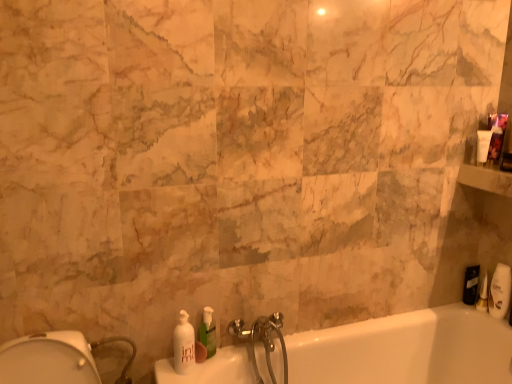
What is the approximate height of silver metallic faucet at lower center?

14.55 inches.

This screenshot has width=512, height=384. Identify the location of black matte toiletry at right, which appears as the 2th toiletry when viewed from the front. (471, 285).

Is white glossy bathtub at lower right situated inside silver metallic faucet at lower center or outside?

white glossy bathtub at lower right lies outside silver metallic faucet at lower center.

Can you confirm if white glossy bathtub at lower right is thinner than silver metallic faucet at lower center?

No, white glossy bathtub at lower right is not thinner than silver metallic faucet at lower center.

Is white glossy bathtub at lower right aimed at silver metallic faucet at lower center?

No, white glossy bathtub at lower right is not aimed at silver metallic faucet at lower center.

From their relative heights in the image, would you say white plastic soap dispenser at right, the 1th toiletry positioned from the front, is taller or shorter than black matte toiletry at right, which appears as the 2th toiletry when viewed from the front?

Clearly, white plastic soap dispenser at right, the 1th toiletry positioned from the front, is shorter compared to black matte toiletry at right, which appears as the 2th toiletry when viewed from the front.

The image size is (512, 384). I want to click on toiletry above the white plastic soap dispenser at right, the 1th toiletry positioned from the front (from the image's perspective), so click(x=471, y=285).

From a real-world perspective, who is located higher, white plastic soap dispenser at right, the 1th toiletry positioned from the front, or black matte toiletry at right, which is counted as the 1th toiletry, starting from the back?

From a 3D spatial view, black matte toiletry at right, which is counted as the 1th toiletry, starting from the back, is above.

Can black matte toiletry at right, which appears as the 2th toiletry when viewed from the front, be found inside white plastic soap dispenser at right, the 1th toiletry positioned from the front?

No, black matte toiletry at right, which appears as the 2th toiletry when viewed from the front, is located outside of white plastic soap dispenser at right, the 1th toiletry positioned from the front.

Is point (212, 317) positioned behind point (252, 325)?

No, it is in front of (252, 325).

Between green translucent soap dispenser at lower center, which ranks as the first soap dispenser in right-to-left order, and silver metallic faucet at lower center, which one has larger size?

silver metallic faucet at lower center.

From the picture: From a real-world perspective, is green translucent soap dispenser at lower center, which ranks as the first soap dispenser in right-to-left order, positioned above or below silver metallic faucet at lower center?

green translucent soap dispenser at lower center, which ranks as the first soap dispenser in right-to-left order, is above silver metallic faucet at lower center.

Does green translucent soap dispenser at lower center, the 2th soap dispenser when ordered from left to right, have a greater height compared to silver metallic faucet at lower center?

In fact, green translucent soap dispenser at lower center, the 2th soap dispenser when ordered from left to right, may be shorter than silver metallic faucet at lower center.

Is black matte toiletry at right, which is counted as the 1th toiletry, starting from the back, turned away from silver metallic faucet at lower center?

No.

Based on the photo, between black matte toiletry at right, which is counted as the 1th toiletry, starting from the back, and silver metallic faucet at lower center, which one has larger size?

With larger size is silver metallic faucet at lower center.

Is black matte toiletry at right, which appears as the 2th toiletry when viewed from the front, not near silver metallic faucet at lower center?

No, there isn't a large distance between black matte toiletry at right, which appears as the 2th toiletry when viewed from the front, and silver metallic faucet at lower center.

Is black matte toiletry at right, which appears as the 2th toiletry when viewed from the front, positioned beyond the bounds of silver metallic faucet at lower center?

Indeed, black matte toiletry at right, which appears as the 2th toiletry when viewed from the front, is completely outside silver metallic faucet at lower center.

Locate an element on the screen. tap that appears below the white plastic soap dispenser at right, which is the second toiletry in back-to-front order (from the image's perspective) is located at coordinates (264, 348).

From a real-world perspective, relative to silver metallic faucet at lower center, is white plastic soap dispenser at right, the 1th toiletry positioned from the front, vertically above or below?

In terms of real-world spatial position, white plastic soap dispenser at right, the 1th toiletry positioned from the front, is above silver metallic faucet at lower center.

Does point (487, 283) lie in front of point (280, 349)?

No, (487, 283) is further to viewer.

Considering the sizes of objects white plastic soap dispenser at right, the 1th toiletry positioned from the front, and silver metallic faucet at lower center in the image provided, who is bigger, white plastic soap dispenser at right, the 1th toiletry positioned from the front, or silver metallic faucet at lower center?

With larger size is silver metallic faucet at lower center.

Looking at this image, who is shorter, white glossy soap dispenser at lower left, the second soap dispenser positioned from the right, or silver metallic faucet at lower center?

white glossy soap dispenser at lower left, the second soap dispenser positioned from the right, is shorter.

Based on their positions, is white glossy soap dispenser at lower left, the second soap dispenser positioned from the right, located to the left or right of silver metallic faucet at lower center?

Clearly, white glossy soap dispenser at lower left, the second soap dispenser positioned from the right, is on the left of silver metallic faucet at lower center in the image.

Can you confirm if white glossy soap dispenser at lower left, the second soap dispenser positioned from the right, is smaller than silver metallic faucet at lower center?

Yes, white glossy soap dispenser at lower left, the second soap dispenser positioned from the right, is smaller than silver metallic faucet at lower center.

Is white glossy soap dispenser at lower left, positioned as the 1th soap dispenser in left-to-right order, positioned with its back to silver metallic faucet at lower center?

No, white glossy soap dispenser at lower left, positioned as the 1th soap dispenser in left-to-right order,'s orientation is not away from silver metallic faucet at lower center.

Between silver metallic faucet at lower center and white glossy bathtub at lower right, which one appears on the right side from the viewer's perspective?

white glossy bathtub at lower right.

Identify the location of tap on the left side of white glossy bathtub at lower right. The height and width of the screenshot is (384, 512). (264, 348).

Considering the points (263, 330) and (162, 374), which point is in front, point (263, 330) or point (162, 374)?

The point (162, 374) is closer to the camera.

Locate an element on the screen. bathtub on the right side of silver metallic faucet at lower center is located at coordinates (406, 349).

Image resolution: width=512 pixels, height=384 pixels. Find the location of `toiletry behind the white plastic soap dispenser at right, which is the second toiletry in back-to-front order`. toiletry behind the white plastic soap dispenser at right, which is the second toiletry in back-to-front order is located at coordinates coord(471,285).

Which object lies further to the anchor point white glossy bathtub at lower right, white glossy soap dispenser at lower left, the second soap dispenser positioned from the right, or green translucent soap dispenser at lower center, the 2th soap dispenser when ordered from left to right?

Among the two, green translucent soap dispenser at lower center, the 2th soap dispenser when ordered from left to right, is located further to white glossy bathtub at lower right.

When comparing their distances from white glossy soap dispenser at lower left, positioned as the 1th soap dispenser in left-to-right order, does black matte toiletry at right, which is counted as the 1th toiletry, starting from the back, or silver metallic faucet at lower center seem closer?

Based on the image, silver metallic faucet at lower center appears to be nearer to white glossy soap dispenser at lower left, positioned as the 1th soap dispenser in left-to-right order.

Estimate the real-world distances between objects in this image. Which object is further from white plastic soap dispenser at right, which is the second toiletry in back-to-front order, white glossy bathtub at lower right or black matte toiletry at right, which appears as the 2th toiletry when viewed from the front?

The object further to white plastic soap dispenser at right, which is the second toiletry in back-to-front order, is white glossy bathtub at lower right.

Estimate the real-world distances between objects in this image. Which object is closer to silver metallic faucet at lower center, white glossy bathtub at lower right or green translucent soap dispenser at lower center, the 2th soap dispenser when ordered from left to right?

green translucent soap dispenser at lower center, the 2th soap dispenser when ordered from left to right, lies closer to silver metallic faucet at lower center than the other object.

Considering their positions, is white plastic soap dispenser at right, the 1th toiletry positioned from the front, positioned further to white glossy bathtub at lower right than green translucent soap dispenser at lower center, the 2th soap dispenser when ordered from left to right?

A: The object further to white glossy bathtub at lower right is green translucent soap dispenser at lower center, the 2th soap dispenser when ordered from left to right.

From the image, which object appears to be nearer to white glossy bathtub at lower right, silver metallic faucet at lower center or black matte toiletry at right, which is counted as the 1th toiletry, starting from the back?

silver metallic faucet at lower center is closer to white glossy bathtub at lower right.

Estimate the real-world distances between objects in this image. Which object is closer to white glossy soap dispenser at lower left, the second soap dispenser positioned from the right, green translucent soap dispenser at lower center, which ranks as the first soap dispenser in right-to-left order, or black matte toiletry at right, which is counted as the 1th toiletry, starting from the back?

green translucent soap dispenser at lower center, which ranks as the first soap dispenser in right-to-left order.

Based on their spatial positions, is white glossy bathtub at lower right or black matte toiletry at right, which is counted as the 1th toiletry, starting from the back, closer to silver metallic faucet at lower center?

The object closer to silver metallic faucet at lower center is white glossy bathtub at lower right.

Image resolution: width=512 pixels, height=384 pixels. I want to click on bathtub between white glossy soap dispenser at lower left, positioned as the 1th soap dispenser in left-to-right order, and black matte toiletry at right, which appears as the 2th toiletry when viewed from the front, in the horizontal direction, so click(406, 349).

Locate an element on the screen. soap dispenser between white glossy soap dispenser at lower left, the second soap dispenser positioned from the right, and white plastic soap dispenser at right, which is the second toiletry in back-to-front order, from left to right is located at coordinates (208, 332).

You are a GUI agent. You are given a task and a screenshot of the screen. Output one action in this format:
    pyautogui.click(x=<x>, y=<y>)
    Task: Click on the soap dispenser between white glossy soap dispenser at lower left, positioned as the 1th soap dispenser in left-to-right order, and black matte toiletry at right, which appears as the 2th toiletry when viewed from the front, in the horizontal direction
    The height and width of the screenshot is (384, 512).
    Given the screenshot: What is the action you would take?
    pyautogui.click(x=208, y=332)

This screenshot has width=512, height=384. What are the coordinates of `tap between green translucent soap dispenser at lower center, the 2th soap dispenser when ordered from left to right, and white glossy bathtub at lower right, in the horizontal direction` in the screenshot? It's located at (264, 348).